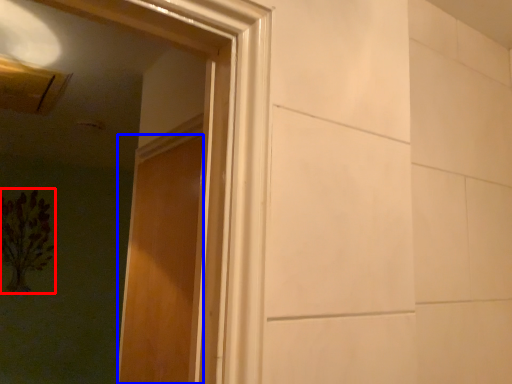
Question: Which of the following is the farthest to the observer, flower (highlighted by a red box) or door (highlighted by a blue box)?

Choices:
 (A) flower
 (B) door

Answer: (A)